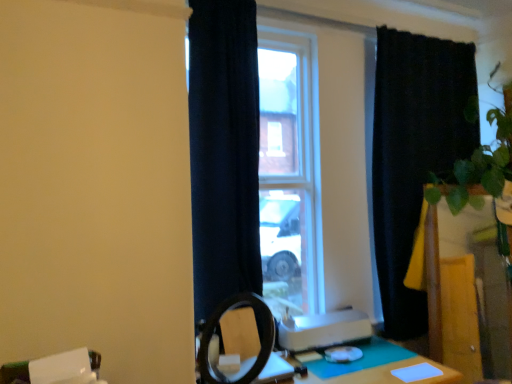
Question: Is green felt table at lower right taller than navy blue curtain at center, the first curtain when ordered from left to right?

Choices:
 (A) yes
 (B) no

Answer: (B)

Question: From a real-world perspective, is green felt table at lower right over navy blue curtain at center, the second curtain positioned from the back?

Choices:
 (A) yes
 (B) no

Answer: (B)

Question: Is navy blue curtain at center, which is the 1th curtain in front-to-back order, surrounded by green felt table at lower right?

Choices:
 (A) yes
 (B) no

Answer: (B)

Question: Does green felt table at lower right have a larger size compared to navy blue curtain at center, the second curtain positioned from the back?

Choices:
 (A) yes
 (B) no

Answer: (B)

Question: Is green felt table at lower right turned away from navy blue curtain at center, which is the 1th curtain in front-to-back order?

Choices:
 (A) no
 (B) yes

Answer: (A)

Question: In the image, is black velvet curtain at right, the second curtain in the left-to-right sequence, positioned in front of or behind navy blue curtain at center, the first curtain when ordered from left to right?

Choices:
 (A) behind
 (B) front

Answer: (A)

Question: Considering the positions of point (478, 140) and point (215, 122), is point (478, 140) closer or farther from the camera than point (215, 122)?

Choices:
 (A) closer
 (B) farther

Answer: (B)

Question: Would you say black velvet curtain at right, positioned as the 2th curtain in front-to-back order, is inside or outside navy blue curtain at center, the second curtain positioned from the back?

Choices:
 (A) outside
 (B) inside

Answer: (A)

Question: From a real-world perspective, is black velvet curtain at right, positioned as the 2th curtain in front-to-back order, physically located above or below navy blue curtain at center, the first curtain when ordered from left to right?

Choices:
 (A) below
 (B) above

Answer: (A)

Question: From a real-world perspective, is navy blue curtain at center, the second curtain positioned from the back, positioned above or below black velvet curtain at right, placed as the 1th curtain when sorted from right to left?

Choices:
 (A) below
 (B) above

Answer: (B)

Question: In the image, is navy blue curtain at center, which is the 1th curtain in front-to-back order, positioned in front of or behind black velvet curtain at right, which ranks as the first curtain in back-to-front order?

Choices:
 (A) behind
 (B) front

Answer: (B)

Question: Based on their positions, is navy blue curtain at center, the second curtain positioned from the back, located to the left or right of black velvet curtain at right, the second curtain in the left-to-right sequence?

Choices:
 (A) left
 (B) right

Answer: (A)

Question: Does point (248, 8) appear closer or farther from the camera than point (388, 173)?

Choices:
 (A) closer
 (B) farther

Answer: (A)

Question: Visually, is green matte plant at right positioned to the left or to the right of green felt table at lower right?

Choices:
 (A) left
 (B) right

Answer: (B)

Question: From a real-world perspective, relative to green felt table at lower right, is green matte plant at right vertically above or below?

Choices:
 (A) below
 (B) above

Answer: (B)